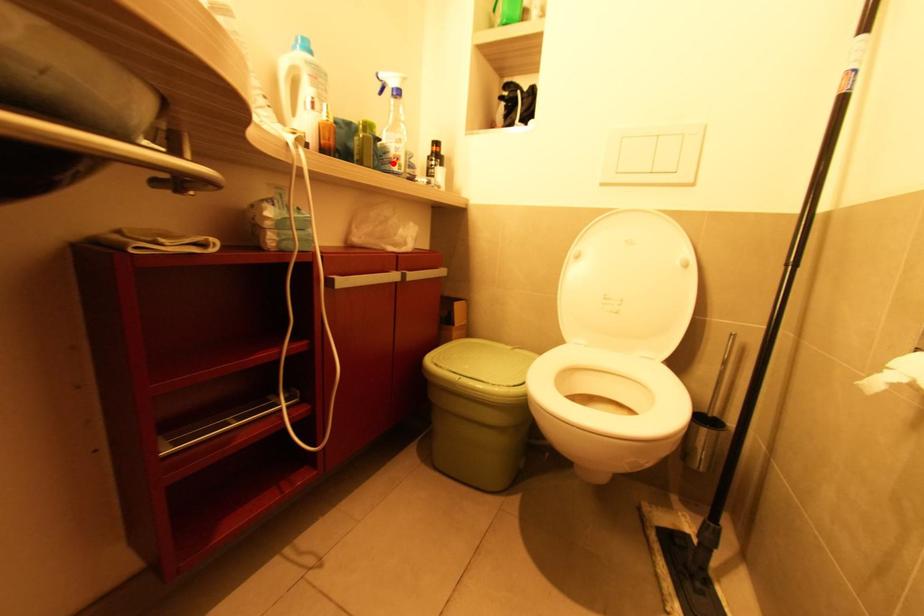
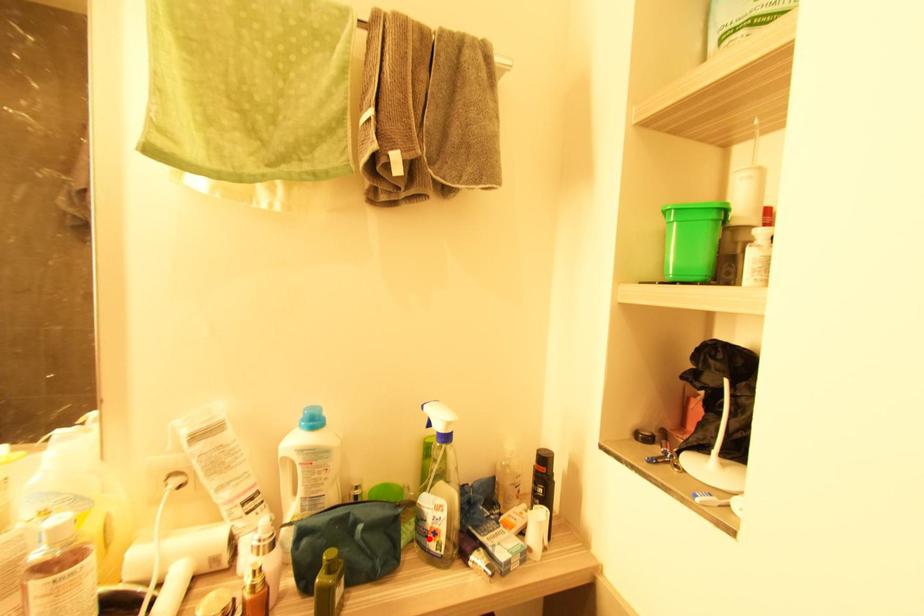
I am providing you with two images of the same scene from different viewpoints. A red point is marked on the first image and another point is marked on the second image. Are the points marked in image1 and image2 representing the same 3D position?

Yes